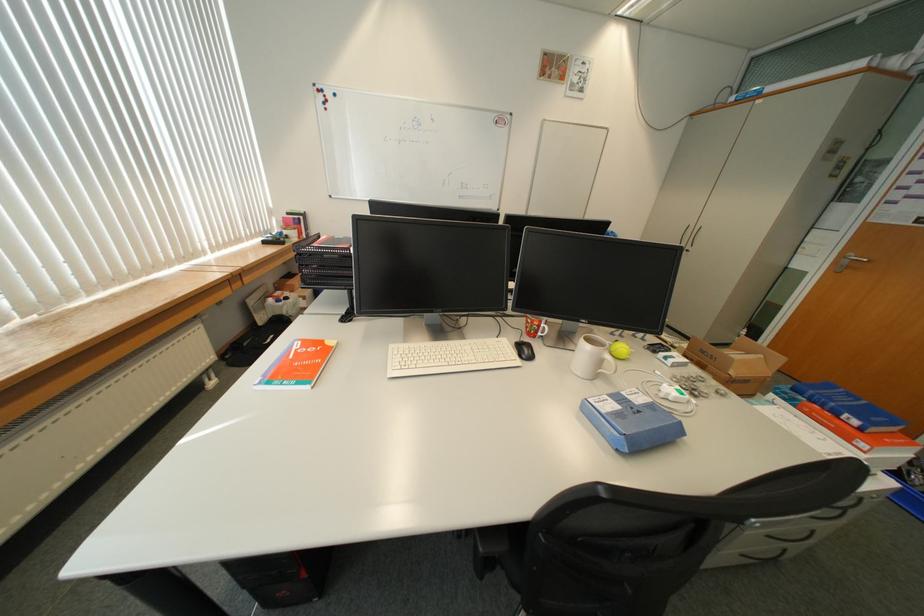
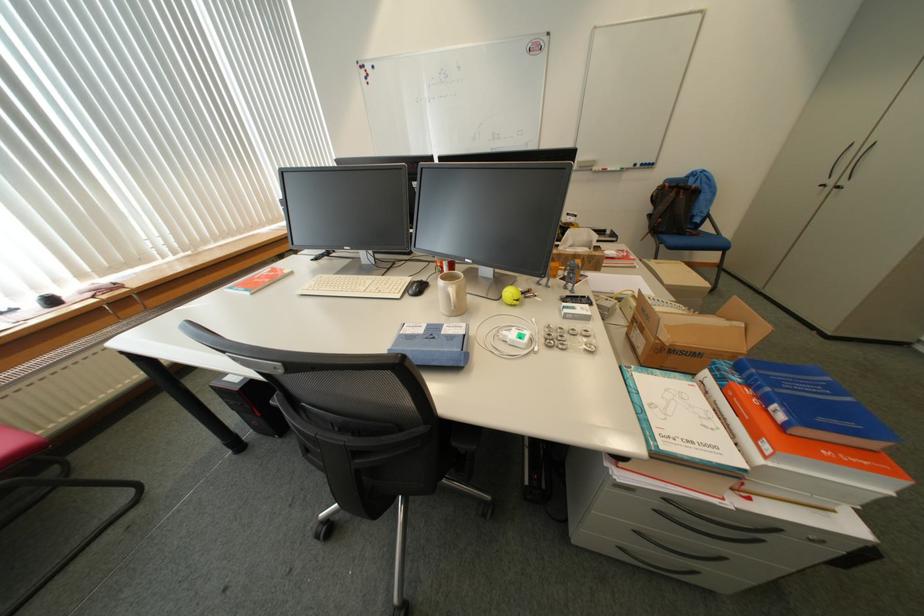
The point at (742,373) is marked in the first image. Where is the corresponding point in the second image?

(675, 339)